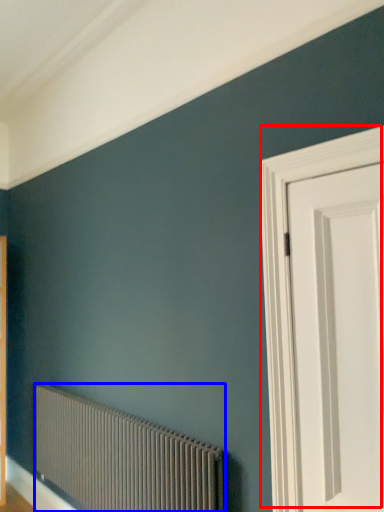
Question: Which object is further to the camera taking this photo, door (highlighted by a red box) or radiator (highlighted by a blue box)?

Choices:
 (A) door
 (B) radiator

Answer: (B)